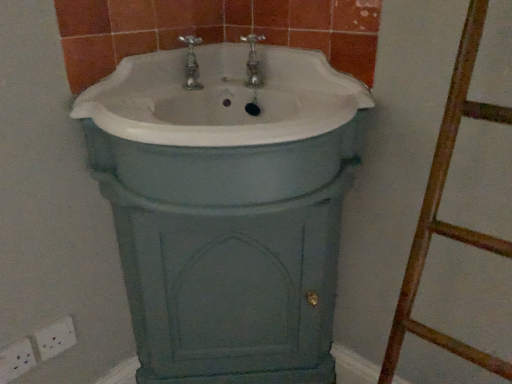
You are a GUI agent. You are given a task and a screenshot of the screen. Output one action in this format:
    pyautogui.click(x=<x>, y=<y>)
    Task: Click on the white ceramic sink at center
    This screenshot has height=384, width=512.
    Given the screenshot: What is the action you would take?
    pyautogui.click(x=227, y=205)

From the image's perspective, between white plastic electric outlet at lower left, which is the 2th electric outlet from right to left, and white ceramic sink at center, who is located below?

white plastic electric outlet at lower left, which is the 2th electric outlet from right to left.

How far apart are white plastic electric outlet at lower left, which is the 2th electric outlet from right to left, and white ceramic sink at center?

white plastic electric outlet at lower left, which is the 2th electric outlet from right to left, is 21.86 inches away from white ceramic sink at center.

Who is taller, white plastic electric outlet at lower left, which is the 1th electric outlet in left-to-right order, or white ceramic sink at center?

Standing taller between the two is white ceramic sink at center.

This screenshot has width=512, height=384. What are the coordinates of `the 2nd electric outlet counting from the left of the white ceramic sink at center` in the screenshot? It's located at (16, 360).

How many degrees apart are the facing directions of white ceramic sink at center and white plastic electric outlet at lower left, which is the 2th electric outlet from right to left?

There is a 85.9-degree angle between the facing directions of white ceramic sink at center and white plastic electric outlet at lower left, which is the 2th electric outlet from right to left.

Does white ceramic sink at center touch white plastic electric outlet at lower left, which is the 1th electric outlet in left-to-right order?

Result: No, white ceramic sink at center is not next to white plastic electric outlet at lower left, which is the 1th electric outlet in left-to-right order.

Does white ceramic sink at center have a larger size compared to white plastic electric outlet at lower left, which is the 1th electric outlet in left-to-right order?

Indeed, white ceramic sink at center has a larger size compared to white plastic electric outlet at lower left, which is the 1th electric outlet in left-to-right order.

From the image's perspective, which one is positioned lower, white ceramic sink at center or white plastic electric outlet at lower left, which is the 2th electric outlet from right to left?

white plastic electric outlet at lower left, which is the 2th electric outlet from right to left, is shown below in the image.

Which object is thinner, white plastic electric outlet at lower left, the 1th electric outlet when ordered from right to left, or white plastic electric outlet at lower left, which is the 1th electric outlet in left-to-right order?

white plastic electric outlet at lower left, the 1th electric outlet when ordered from right to left, is thinner.

Does white plastic electric outlet at lower left, the 1th electric outlet when ordered from right to left, touch white plastic electric outlet at lower left, which is the 1th electric outlet in left-to-right order?

Yes, white plastic electric outlet at lower left, the 1th electric outlet when ordered from right to left, is beside white plastic electric outlet at lower left, which is the 1th electric outlet in left-to-right order.

Could you measure the distance between white plastic electric outlet at lower left, marked as the 2th electric outlet in a left-to-right arrangement, and white plastic electric outlet at lower left, which is the 2th electric outlet from right to left?

white plastic electric outlet at lower left, marked as the 2th electric outlet in a left-to-right arrangement, and white plastic electric outlet at lower left, which is the 2th electric outlet from right to left, are 2.07 inches apart from each other.

Could you tell me if white plastic electric outlet at lower left, the 1th electric outlet when ordered from right to left, is turned towards white plastic electric outlet at lower left, which is the 2th electric outlet from right to left?

No, white plastic electric outlet at lower left, the 1th electric outlet when ordered from right to left, is not oriented towards white plastic electric outlet at lower left, which is the 2th electric outlet from right to left.

Does white ceramic sink at center turn towards white plastic electric outlet at lower left, marked as the 2th electric outlet in a left-to-right arrangement?

Yes, white ceramic sink at center is oriented towards white plastic electric outlet at lower left, marked as the 2th electric outlet in a left-to-right arrangement.

Does white ceramic sink at center have a larger size compared to white plastic electric outlet at lower left, marked as the 2th electric outlet in a left-to-right arrangement?

Yes, white ceramic sink at center is bigger than white plastic electric outlet at lower left, marked as the 2th electric outlet in a left-to-right arrangement.

From a real-world perspective, which is physically above, white ceramic sink at center or white plastic electric outlet at lower left, marked as the 2th electric outlet in a left-to-right arrangement?

In real-world perspective, white ceramic sink at center is above.

Looking at this image, from a real-world perspective, is white plastic electric outlet at lower left, which is the 1th electric outlet in left-to-right order, above or below white plastic electric outlet at lower left, marked as the 2th electric outlet in a left-to-right arrangement?

white plastic electric outlet at lower left, which is the 1th electric outlet in left-to-right order, is situated lower than white plastic electric outlet at lower left, marked as the 2th electric outlet in a left-to-right arrangement, in the real world.

Which point is more distant from viewer, [23,359] or [38,343]?

Point [38,343]

Could you tell me if white plastic electric outlet at lower left, which is the 1th electric outlet in left-to-right order, is turned towards white plastic electric outlet at lower left, the 1th electric outlet when ordered from right to left?

No, white plastic electric outlet at lower left, which is the 1th electric outlet in left-to-right order, is not aimed at white plastic electric outlet at lower left, the 1th electric outlet when ordered from right to left.

Image resolution: width=512 pixels, height=384 pixels. I want to click on electric outlet behind the white plastic electric outlet at lower left, which is the 1th electric outlet in left-to-right order, so click(55, 338).

From the image's perspective, is white plastic electric outlet at lower left, the 1th electric outlet when ordered from right to left, below white ceramic sink at center?

Yes.

How many degrees apart are the facing directions of white plastic electric outlet at lower left, the 1th electric outlet when ordered from right to left, and white ceramic sink at center?

white plastic electric outlet at lower left, the 1th electric outlet when ordered from right to left, and white ceramic sink at center are facing 87.4 degrees away from each other.

Looking at this image, can you confirm if white plastic electric outlet at lower left, marked as the 2th electric outlet in a left-to-right arrangement, is wider than white ceramic sink at center?

In fact, white plastic electric outlet at lower left, marked as the 2th electric outlet in a left-to-right arrangement, might be narrower than white ceramic sink at center.

Is white plastic electric outlet at lower left, marked as the 2th electric outlet in a left-to-right arrangement, far from white ceramic sink at center?

No.

Image resolution: width=512 pixels, height=384 pixels. In the image, there is a white plastic electric outlet at lower left, which is the 2th electric outlet from right to left. Identify the location of porcelain above it (from the image's perspective). (227, 205).

Image resolution: width=512 pixels, height=384 pixels. What are the coordinates of `porcelain in front of the white plastic electric outlet at lower left, which is the 2th electric outlet from right to left` in the screenshot? It's located at (227, 205).

Considering their positions, is white plastic electric outlet at lower left, which is the 2th electric outlet from right to left, positioned closer to white ceramic sink at center than white plastic electric outlet at lower left, marked as the 2th electric outlet in a left-to-right arrangement?

white plastic electric outlet at lower left, marked as the 2th electric outlet in a left-to-right arrangement, lies closer to white ceramic sink at center than the other object.

Looking at the image, which one is located closer to white plastic electric outlet at lower left, marked as the 2th electric outlet in a left-to-right arrangement, white ceramic sink at center or white plastic electric outlet at lower left, which is the 1th electric outlet in left-to-right order?

white plastic electric outlet at lower left, which is the 1th electric outlet in left-to-right order, is closer to white plastic electric outlet at lower left, marked as the 2th electric outlet in a left-to-right arrangement.

Estimate the real-world distances between objects in this image. Which object is closer to white ceramic sink at center, white plastic electric outlet at lower left, marked as the 2th electric outlet in a left-to-right arrangement, or white plastic electric outlet at lower left, which is the 2th electric outlet from right to left?

Among the two, white plastic electric outlet at lower left, marked as the 2th electric outlet in a left-to-right arrangement, is located nearer to white ceramic sink at center.

When comparing their distances from white plastic electric outlet at lower left, which is the 1th electric outlet in left-to-right order, does white ceramic sink at center or white plastic electric outlet at lower left, the 1th electric outlet when ordered from right to left, seem further?

white ceramic sink at center is positioned further to the anchor white plastic electric outlet at lower left, which is the 1th electric outlet in left-to-right order.

Based on their spatial positions, is white plastic electric outlet at lower left, which is the 2th electric outlet from right to left, or white ceramic sink at center further from white plastic electric outlet at lower left, the 1th electric outlet when ordered from right to left?

Among the two, white ceramic sink at center is located further to white plastic electric outlet at lower left, the 1th electric outlet when ordered from right to left.

When comparing their distances from white plastic electric outlet at lower left, which is the 2th electric outlet from right to left, does white plastic electric outlet at lower left, marked as the 2th electric outlet in a left-to-right arrangement, or white ceramic sink at center seem closer?

Among the two, white plastic electric outlet at lower left, marked as the 2th electric outlet in a left-to-right arrangement, is located nearer to white plastic electric outlet at lower left, which is the 2th electric outlet from right to left.

In order to click on electric outlet between white plastic electric outlet at lower left, which is the 1th electric outlet in left-to-right order, and white ceramic sink at center, in the horizontal direction in this screenshot , I will do `click(55, 338)`.